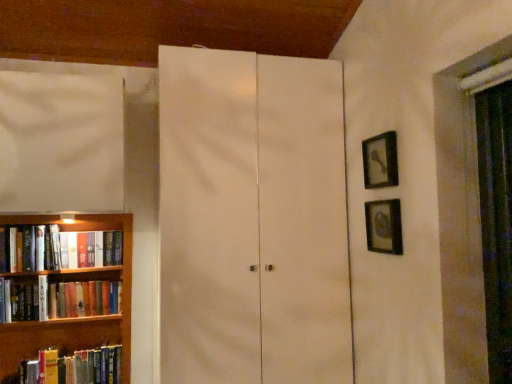
Question: Can we say wooden bookshelf at left lies outside black matte picture frame at upper right, which ranks as the second picture frame in bottom-to-top order?

Choices:
 (A) yes
 (B) no

Answer: (A)

Question: Is wooden bookshelf at left at the left side of black matte picture frame at upper right, which ranks as the second picture frame in bottom-to-top order?

Choices:
 (A) yes
 (B) no

Answer: (A)

Question: Could you tell me if wooden bookshelf at left is turned towards black matte picture frame at upper right, the 1th picture frame from the top?

Choices:
 (A) yes
 (B) no

Answer: (B)

Question: Is wooden bookshelf at left wider than black matte picture frame at upper right, which ranks as the second picture frame in bottom-to-top order?

Choices:
 (A) no
 (B) yes

Answer: (B)

Question: From the image's perspective, is wooden bookshelf at left beneath black matte picture frame at upper right, which ranks as the second picture frame in bottom-to-top order?

Choices:
 (A) no
 (B) yes

Answer: (B)

Question: From the image's perspective, is black matte picture frame at upper right, which ranks as the second picture frame in bottom-to-top order, positioned above or below wooden bookshelf at left?

Choices:
 (A) above
 (B) below

Answer: (A)

Question: From a real-world perspective, is black matte picture frame at upper right, the 1th picture frame from the top, above or below wooden bookshelf at left?

Choices:
 (A) above
 (B) below

Answer: (A)

Question: Visually, is black matte picture frame at upper right, the 1th picture frame from the top, positioned to the left or to the right of wooden bookshelf at left?

Choices:
 (A) right
 (B) left

Answer: (A)

Question: Is black matte picture frame at upper right, the 1th picture frame from the top, situated inside wooden bookshelf at left or outside?

Choices:
 (A) outside
 (B) inside

Answer: (A)

Question: From their relative heights in the image, would you say white matte cabinet at center is taller or shorter than wooden bookshelf at left?

Choices:
 (A) short
 (B) tall

Answer: (B)

Question: From a real-world perspective, is white matte cabinet at center positioned above or below wooden bookshelf at left?

Choices:
 (A) below
 (B) above

Answer: (B)

Question: Is white matte cabinet at center wider or thinner than wooden bookshelf at left?

Choices:
 (A) wide
 (B) thin

Answer: (A)

Question: Does point (x=239, y=334) appear closer or farther from the camera than point (x=29, y=218)?

Choices:
 (A) farther
 (B) closer

Answer: (B)

Question: Considering their positions, is hardcover book at left, the second book when ordered from bottom to top, located in front of or behind metallic silver picture frame at right, which ranks as the first picture frame in bottom-to-top order?

Choices:
 (A) behind
 (B) front

Answer: (A)

Question: Considering the positions of hardcover book at left, the second book when ordered from bottom to top, and metallic silver picture frame at right, the 2th picture frame in the top-to-bottom sequence, in the image, is hardcover book at left, the second book when ordered from bottom to top, taller or shorter than metallic silver picture frame at right, the 2th picture frame in the top-to-bottom sequence,?

Choices:
 (A) short
 (B) tall

Answer: (A)